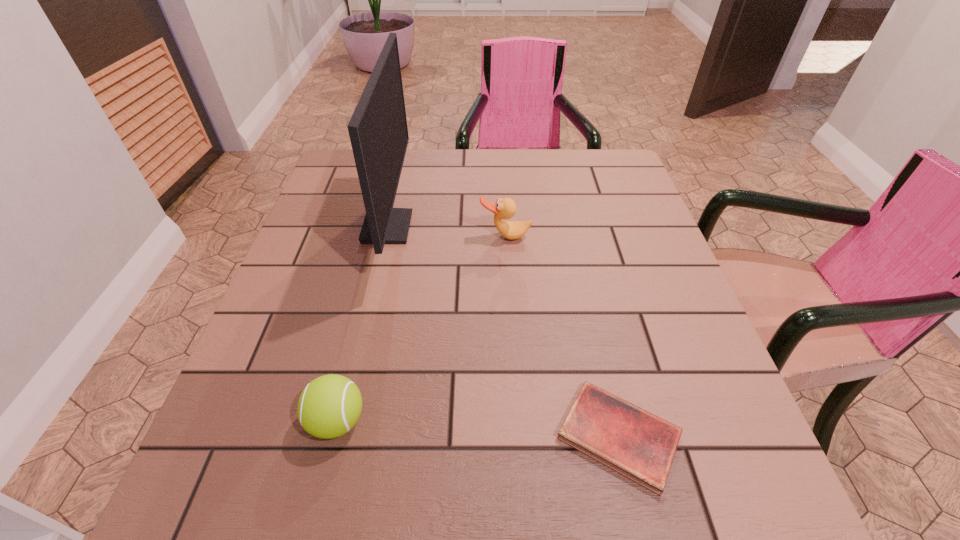
Identify the location of object at the near edge. (641, 446).

Identify the location of computer monitor present at the left edge. (378, 131).

What are the coordinates of `tennis ball that is at the left edge` in the screenshot? It's located at (329, 406).

I want to click on object present at the right edge, so click(641, 446).

Find the location of `object present at the far left corner`. object present at the far left corner is located at coordinates (378, 131).

In order to click on object located in the near right corner section of the desktop in this screenshot , I will do `click(641, 446)`.

This screenshot has width=960, height=540. In order to click on vacant space at the far edge of the desktop in this screenshot , I will do `click(529, 174)`.

In the image, there is a desktop. Find the location of `vacant space at the near edge`. vacant space at the near edge is located at coordinates (333, 472).

In the image, there is a desktop. At what (x,y) coordinates should I click in order to perform the action: click on free region at the left edge. Please return your answer as a coordinate pair (x, y). The width and height of the screenshot is (960, 540). Looking at the image, I should click on (274, 385).

Identify the location of vacant space at the right edge of the desktop. This screenshot has width=960, height=540. (648, 317).